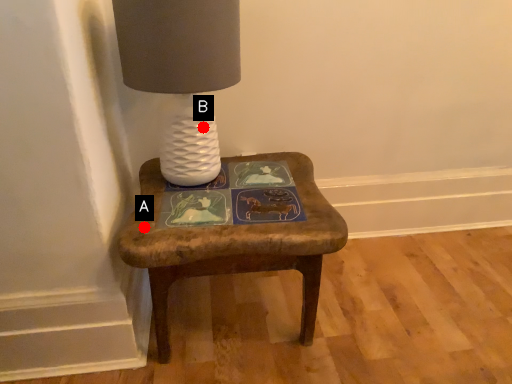
Question: Two points are circled on the image, labeled by A and B beside each circle. Which point is farther to the camera?

Choices:
 (A) A is further
 (B) B is further

Answer: (B)